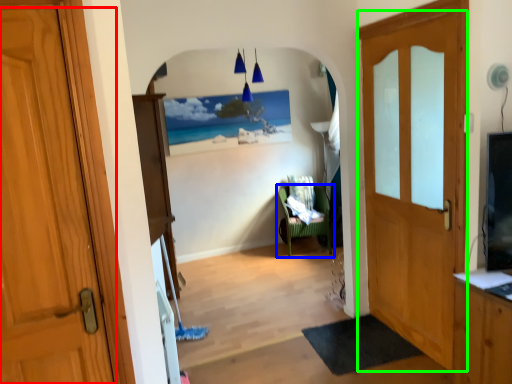
Question: Estimate the real-world distances between objects in this image. Which object is farther from door (highlighted by a red box), chair (highlighted by a blue box) or door (highlighted by a green box)?

Choices:
 (A) chair
 (B) door

Answer: (A)